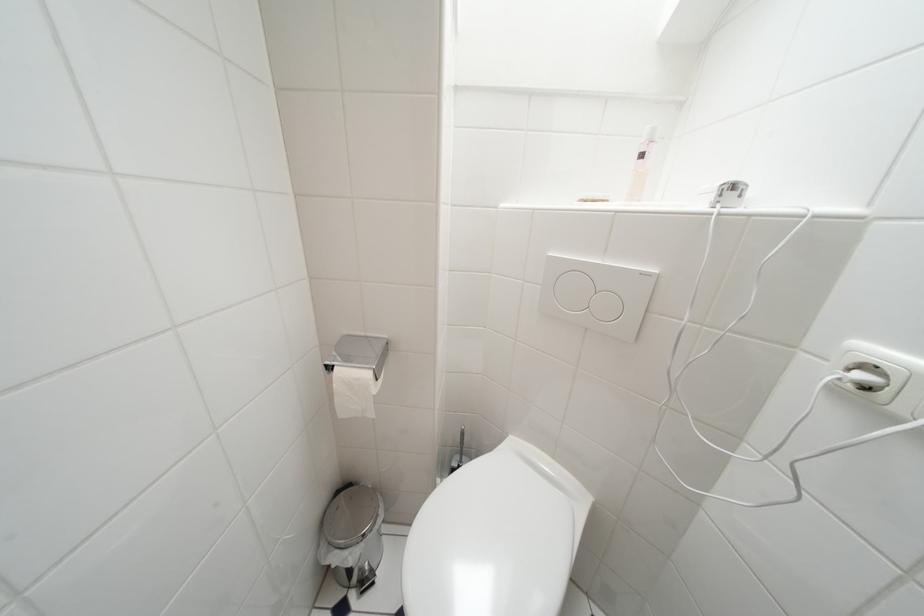
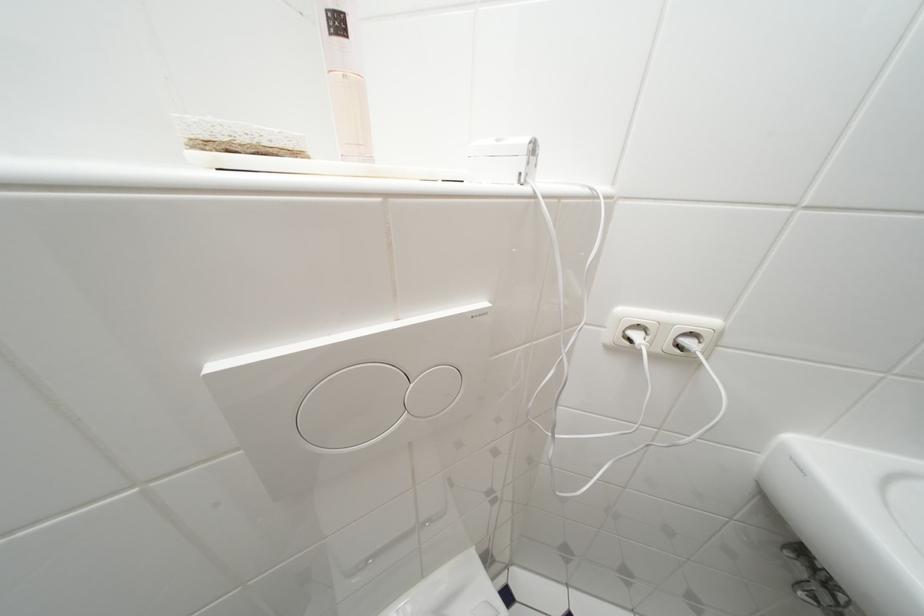
First-person continuous shooting, in which direction is the camera rotating?

The camera's rotation is toward right-down.